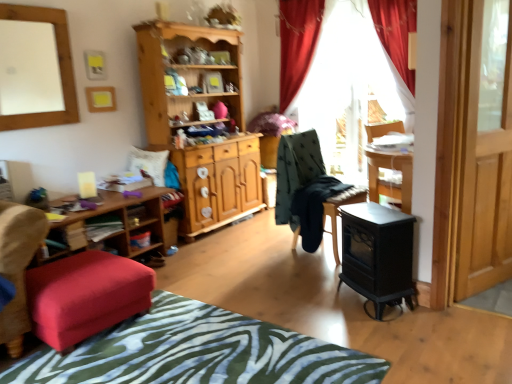
This screenshot has height=384, width=512. I want to click on free space behind zebra print fabric at lower center, so (242, 272).